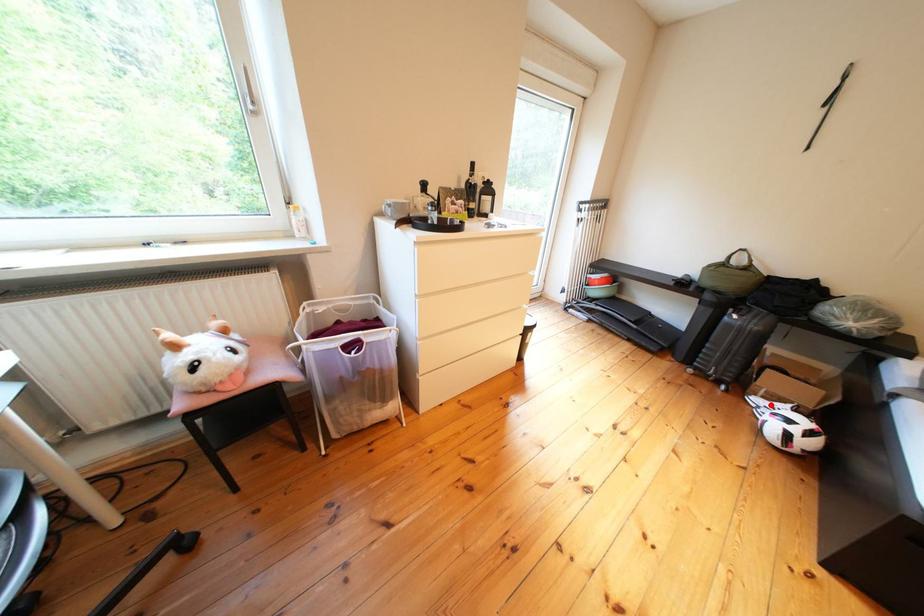
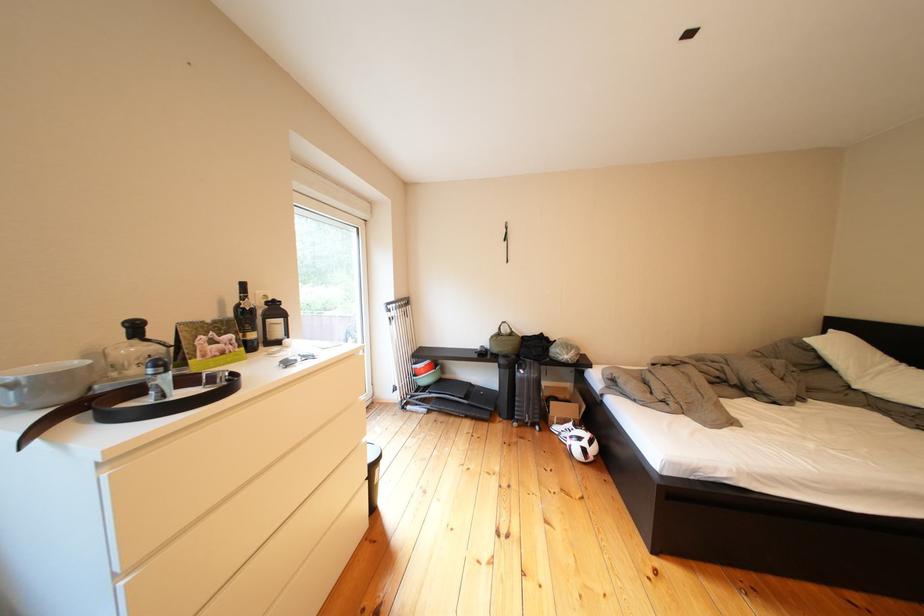
Question: I am providing you with two images of the same scene from different viewpoints. Given a red point in image1, look at the same physical point in image2. Is it:

Choices:
 (A) Closer to the viewpoint
 (B) Farther from the viewpoint

Answer: (B)